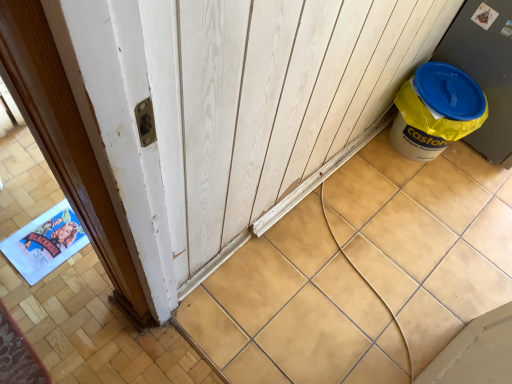
Question: Is point (424, 81) closer or farther from the camera than point (156, 104)?

Choices:
 (A) farther
 (B) closer

Answer: (A)

Question: Is yellow plastic canister at right to the left or to the right of wooden at lower right in the image?

Choices:
 (A) left
 (B) right

Answer: (B)

Question: Is yellow plastic canister at right taller or shorter than wooden at lower right?

Choices:
 (A) tall
 (B) short

Answer: (A)

Question: From the image's perspective, relative to yellow plastic canister at right, is wooden at lower right above or below?

Choices:
 (A) above
 (B) below

Answer: (B)

Question: Is wooden at lower right bigger or smaller than yellow plastic canister at right?

Choices:
 (A) big
 (B) small

Answer: (A)

Question: From a real-world perspective, is wooden at lower right above or below yellow plastic canister at right?

Choices:
 (A) above
 (B) below

Answer: (B)

Question: Considering their positions, is wooden at lower right located in front of or behind yellow plastic canister at right?

Choices:
 (A) front
 (B) behind

Answer: (A)